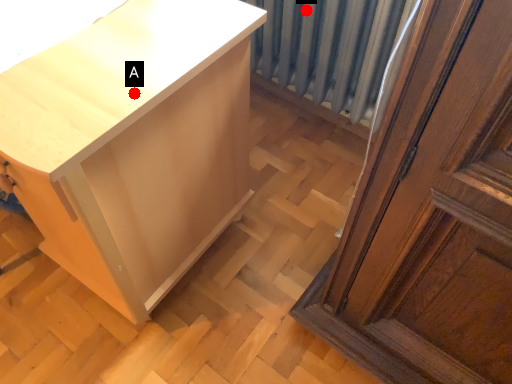
Question: Two points are circled on the image, labeled by A and B beside each circle. Among these points, which one is nearest to the camera?

Choices:
 (A) A is closer
 (B) B is closer

Answer: (A)